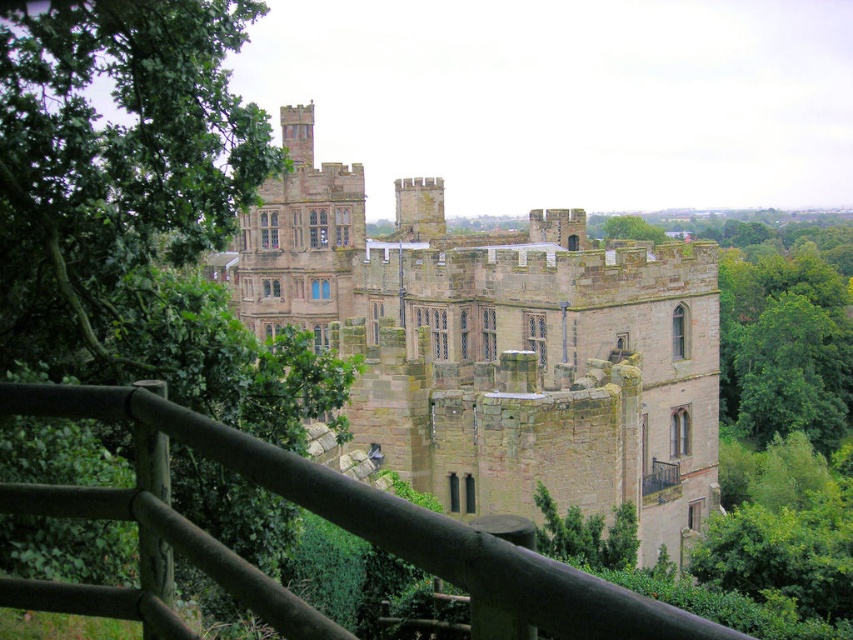
Looking at this image, who is more forward, (340,278) or (315,508)?

Point (315,508) is more forward.

How distant is brown stone castle at center from brown wooden fence at lower center?

227.18 feet

Where is `brown stone castle at center`? Image resolution: width=853 pixels, height=640 pixels. brown stone castle at center is located at coordinates (494, 342).

Does green leafy tree at left appear under brown wooden fence at lower center?

Actually, green leafy tree at left is above brown wooden fence at lower center.

Based on the photo, does green leafy tree at left have a smaller size compared to brown wooden fence at lower center?

Incorrect, green leafy tree at left is not smaller in size than brown wooden fence at lower center.

Find the location of `green leafy tree at left`. green leafy tree at left is located at coordinates (138, 209).

Which of these two, brown stone castle at center or green leafy tree at left, stands taller?

Standing taller between the two is brown stone castle at center.

This screenshot has width=853, height=640. Identify the location of brown stone castle at center. (494, 342).

Image resolution: width=853 pixels, height=640 pixels. Find the location of `brown stone castle at center`. brown stone castle at center is located at coordinates (494, 342).